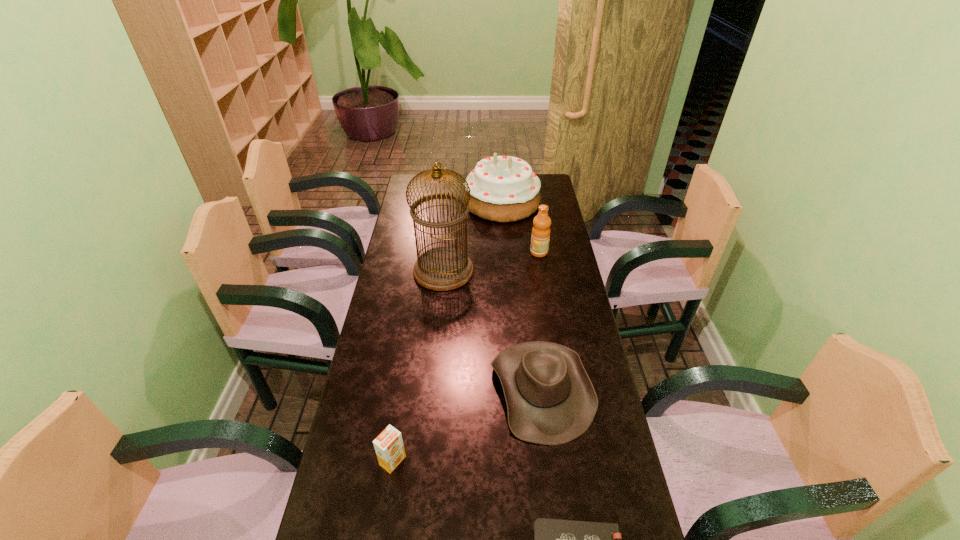
Where is `free space located 0.360m on the back of the orange juice`? This screenshot has height=540, width=960. free space located 0.360m on the back of the orange juice is located at coordinates tap(411, 343).

Find the location of a particular element. This screenshot has height=540, width=960. free space located 0.200m on the front of the cowboy hat is located at coordinates (560, 528).

Where is `object at the far edge`? object at the far edge is located at coordinates (503, 189).

You are a GUI agent. You are given a task and a screenshot of the screen. Output one action in this format:
    pyautogui.click(x=<x>, y=<y>)
    Task: Click on the birdcage that is at the left edge
    This screenshot has width=960, height=540.
    Given the screenshot: What is the action you would take?
    pyautogui.click(x=442, y=268)

This screenshot has width=960, height=540. I want to click on orange juice present at the left edge, so click(x=389, y=448).

Locate an element on the screen. This screenshot has height=540, width=960. cake that is positioned at the right edge is located at coordinates (503, 189).

Image resolution: width=960 pixels, height=540 pixels. In order to click on fruit juice positioned at the right edge in this screenshot , I will do `click(540, 237)`.

Locate an element on the screen. cowboy hat present at the right edge is located at coordinates (550, 398).

Identify the location of object at the far right corner. (503, 189).

Locate an element on the screen. The height and width of the screenshot is (540, 960). free space at the left edge is located at coordinates click(x=408, y=332).